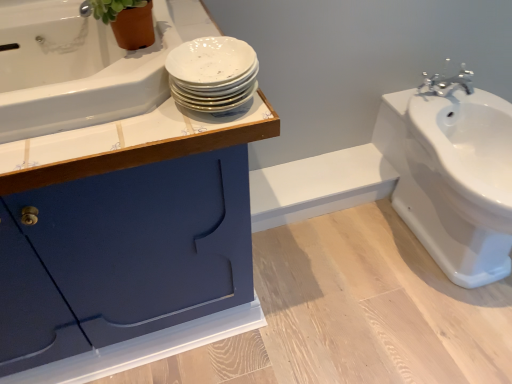
What are the coordinates of `vacant space to the left of white glossy plates at upper center` in the screenshot? It's located at pos(116,128).